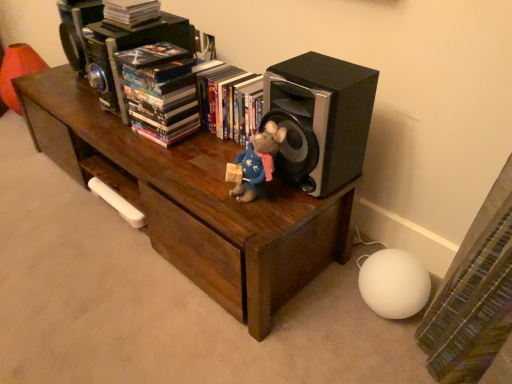
Where is `free space on the front side of hardcover book at center, arranged as the first book when viewed from the right`? This screenshot has width=512, height=384. free space on the front side of hardcover book at center, arranged as the first book when viewed from the right is located at coordinates (210, 168).